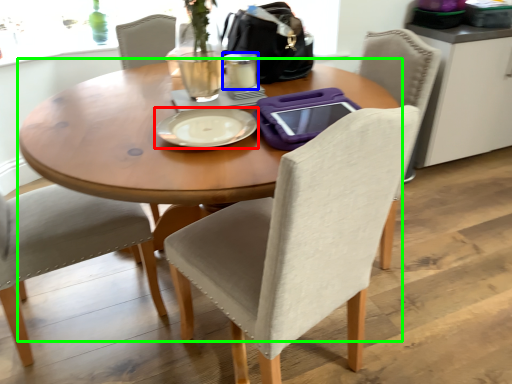
Question: Considering the real-world distances, which object is farthest from plate (highlighted by a red box)? coffee cup (highlighted by a blue box) or kitchen & dining room table (highlighted by a green box)?

Choices:
 (A) coffee cup
 (B) kitchen & dining room table

Answer: (A)